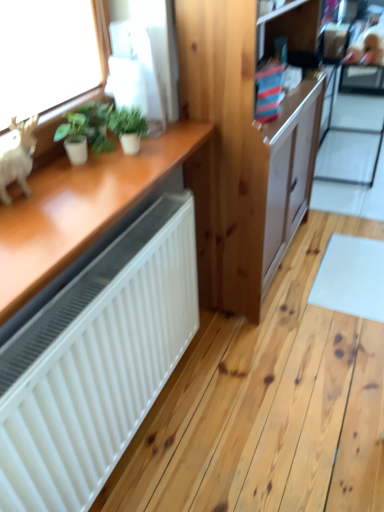
Question: Considering the relative sizes of green matte plant at upper left, placed as the 1th houseplant when sorted from right to left, and white matte figurine at left in the image provided, is green matte plant at upper left, placed as the 1th houseplant when sorted from right to left, smaller than white matte figurine at left?

Choices:
 (A) yes
 (B) no

Answer: (A)

Question: Considering the relative positions of green matte plant at upper left, arranged as the 2th houseplant when viewed from the left, and white matte figurine at left in the image provided, is green matte plant at upper left, arranged as the 2th houseplant when viewed from the left, in front of white matte figurine at left?

Choices:
 (A) yes
 (B) no

Answer: (B)

Question: Is the position of green matte plant at upper left, placed as the 1th houseplant when sorted from right to left, more distant than that of white matte figurine at left?

Choices:
 (A) yes
 (B) no

Answer: (A)

Question: From a real-world perspective, is green matte plant at upper left, placed as the 1th houseplant when sorted from right to left, positioned under white matte figurine at left based on gravity?

Choices:
 (A) no
 (B) yes

Answer: (B)

Question: Is green matte plant at upper left, arranged as the 2th houseplant when viewed from the left, outside of white matte figurine at left?

Choices:
 (A) yes
 (B) no

Answer: (A)

Question: From the image's perspective, is white matte figurine at left located above or below green matte plant at upper left, which is the first houseplant from left to right?

Choices:
 (A) above
 (B) below

Answer: (B)

Question: Based on their sizes in the image, would you say white matte figurine at left is bigger or smaller than green matte plant at upper left, which is the first houseplant from left to right?

Choices:
 (A) small
 (B) big

Answer: (B)

Question: Based on their positions, is white matte figurine at left located to the left or right of green matte plant at upper left, the second houseplant in the right-to-left sequence?

Choices:
 (A) right
 (B) left

Answer: (B)

Question: Choose the correct answer: Is white matte figurine at left inside green matte plant at upper left, which is the first houseplant from left to right, or outside it?

Choices:
 (A) inside
 (B) outside

Answer: (B)

Question: From a real-world perspective, is natural wood cabinet at center above or below transparent glass screen door at upper right?

Choices:
 (A) above
 (B) below

Answer: (A)

Question: From the image's perspective, is natural wood cabinet at center located above or below transparent glass screen door at upper right?

Choices:
 (A) above
 (B) below

Answer: (B)

Question: Is natural wood cabinet at center bigger or smaller than transparent glass screen door at upper right?

Choices:
 (A) big
 (B) small

Answer: (A)

Question: In terms of height, does natural wood cabinet at center look taller or shorter compared to transparent glass screen door at upper right?

Choices:
 (A) short
 (B) tall

Answer: (B)

Question: Is white matte figurine at left wider or thinner than green matte plant at upper left, arranged as the 2th houseplant when viewed from the left?

Choices:
 (A) thin
 (B) wide

Answer: (A)

Question: In terms of height, does white matte figurine at left look taller or shorter compared to green matte plant at upper left, placed as the 1th houseplant when sorted from right to left?

Choices:
 (A) tall
 (B) short

Answer: (A)